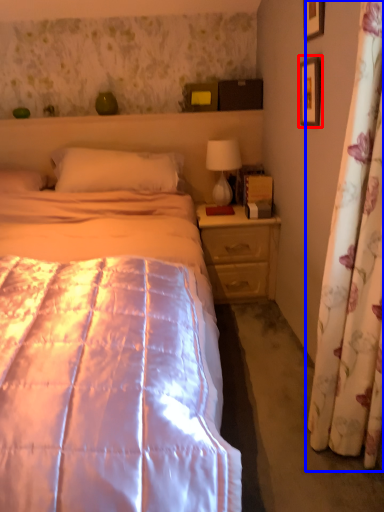
Question: Which object appears farthest to the camera in this image, picture frame (highlighted by a red box) or curtain (highlighted by a blue box)?

Choices:
 (A) picture frame
 (B) curtain

Answer: (A)